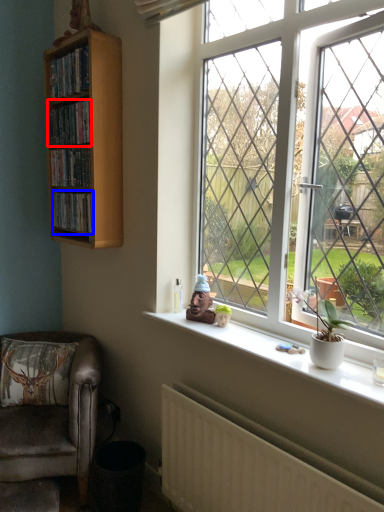
Question: Which point is closer to the camera, book (highlighted by a red box) or book (highlighted by a blue box)?

Choices:
 (A) book
 (B) book

Answer: (A)